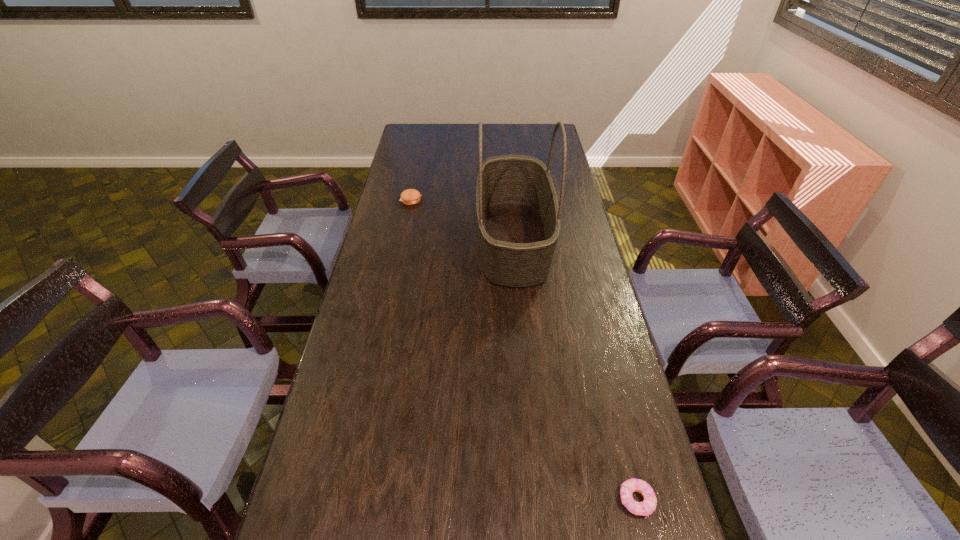
What are the coordinates of `free space between the leftmost object and the tallest object` in the screenshot? It's located at (462, 220).

Where is `vacant point located between the doughnut and the second shortest object`? Image resolution: width=960 pixels, height=540 pixels. vacant point located between the doughnut and the second shortest object is located at coordinates (523, 350).

I want to click on unoccupied position between the leftmost object and the tallest object, so click(462, 220).

This screenshot has width=960, height=540. What are the coordinates of `vacant area that lies between the second object from right to left and the leftmost object` in the screenshot? It's located at point(462,220).

Identify the location of free space between the basket and the rightmost object. (575, 370).

Identify the location of vacant area that lies between the patty and the nearest object. (523, 350).

Select which object appears as the second closest to the second object from left to right. Please provide its 2D coordinates. Your answer should be formatted as a tuple, i.e. [(x, y)], where the tuple contains the x and y coordinates of a point satisfying the conditions above.

[(647, 507)]

Identify which object is located as the second nearest to the leftmost object. Please provide its 2D coordinates. Your answer should be formatted as a tuple, i.e. [(x, y)], where the tuple contains the x and y coordinates of a point satisfying the conditions above.

[(647, 507)]

At what (x,y) coordinates should I click in order to perform the action: click on vacant space that satisfies the following two spatial constraints: 1. on the front side of the patty; 2. on the right side of the second object from left to right. Please return your answer as a coordinate pair (x, y). The image size is (960, 540). Looking at the image, I should click on (402, 240).

Locate an element on the screen. The image size is (960, 540). blank area in the image that satisfies the following two spatial constraints: 1. on the front side of the second object from right to left; 2. on the right side of the patty is located at coordinates (402, 240).